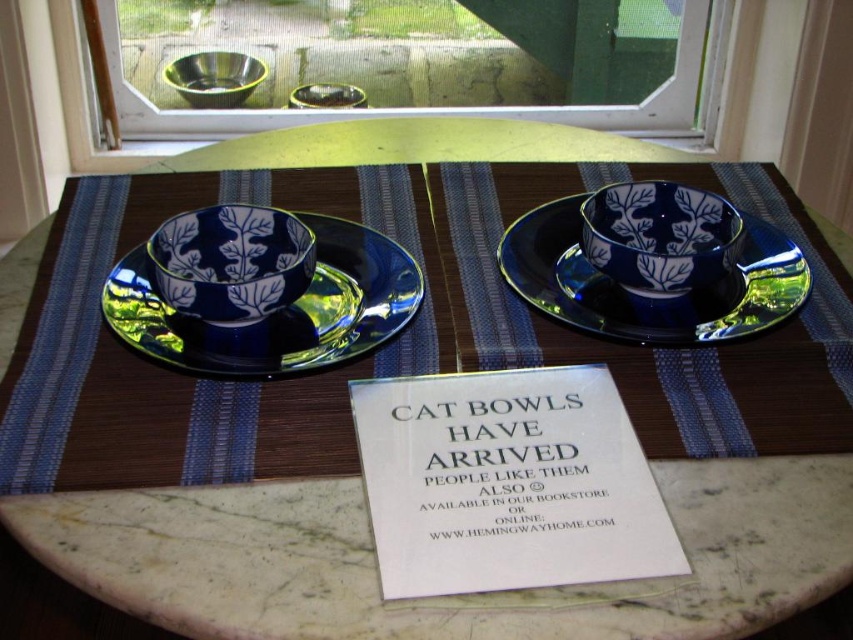
You are arranging cat bowls on a table and need to place a new bowl between the two points given. The first point is point (283, 285) and the second is point (167, 147). Based on their positions, which point should the new bowl be closer to if it needs to be placed in front of the existing setup?

The new bowl should be placed closer to point (167, 147) because point (283, 285) is in front of point (167, 147). To place the new bowl in front of the existing setup, it should be closer to the point that is further back, which is point (167, 147).